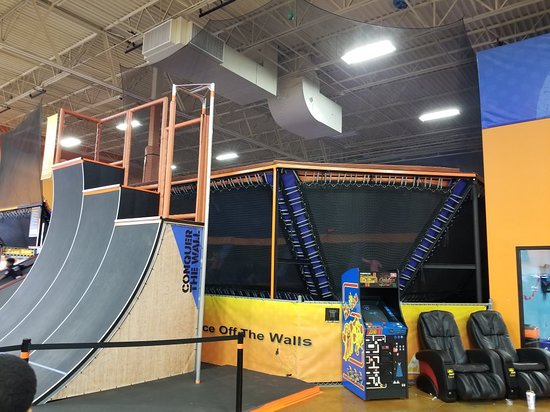
Locate an element on the screen. This screenshot has width=550, height=412. ceiling is located at coordinates coord(116,9).